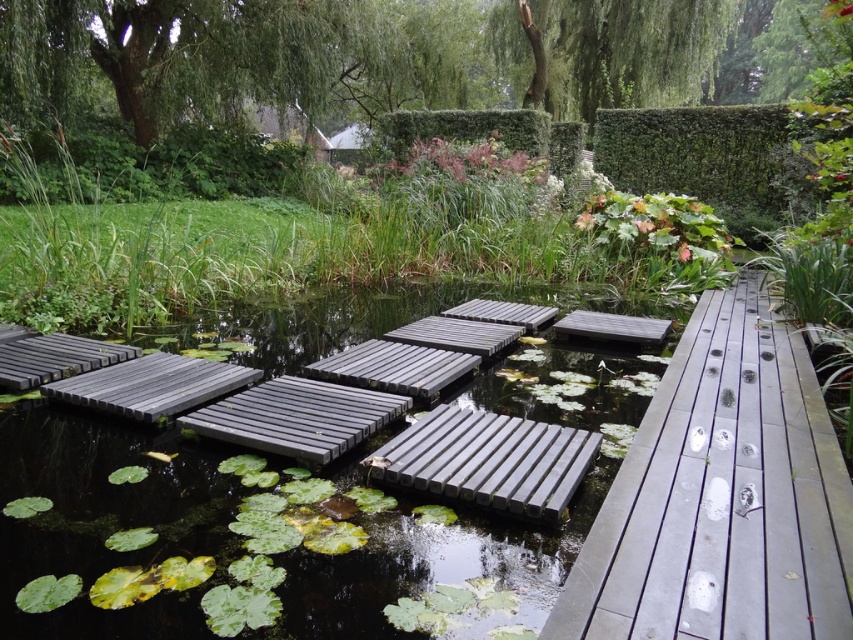
Who is more distant from viewer, (535, 403) or (595, 317)?

The point (595, 317) is more distant.

I want to click on smooth black planks at center, so tap(473, 515).

Locate an element on the screen. smooth black planks at center is located at coordinates (473, 515).

Identify the location of smooth black planks at center. This screenshot has width=853, height=640. tap(473, 515).

Is green leafy tree at upper left closer to camera compared to matte black wooden planks at center?

No, it is behind matte black wooden planks at center.

Can you confirm if green leafy tree at upper left is thinner than matte black wooden planks at center?

No, green leafy tree at upper left is not thinner than matte black wooden planks at center.

Who is more forward, (x=178, y=106) or (x=219, y=368)?

Positioned in front is point (x=219, y=368).

Locate an element on the screen. The image size is (853, 640). green leafy tree at upper left is located at coordinates (190, 54).

Who is positioned more to the right, matte black wooden planks at center or charcoal gray wood floating bridge at lower left?

matte black wooden planks at center

Locate an element on the screen. The image size is (853, 640). matte black wooden planks at center is located at coordinates (151, 385).

The image size is (853, 640). In order to click on matte black wooden planks at center in this screenshot , I will do `click(151, 385)`.